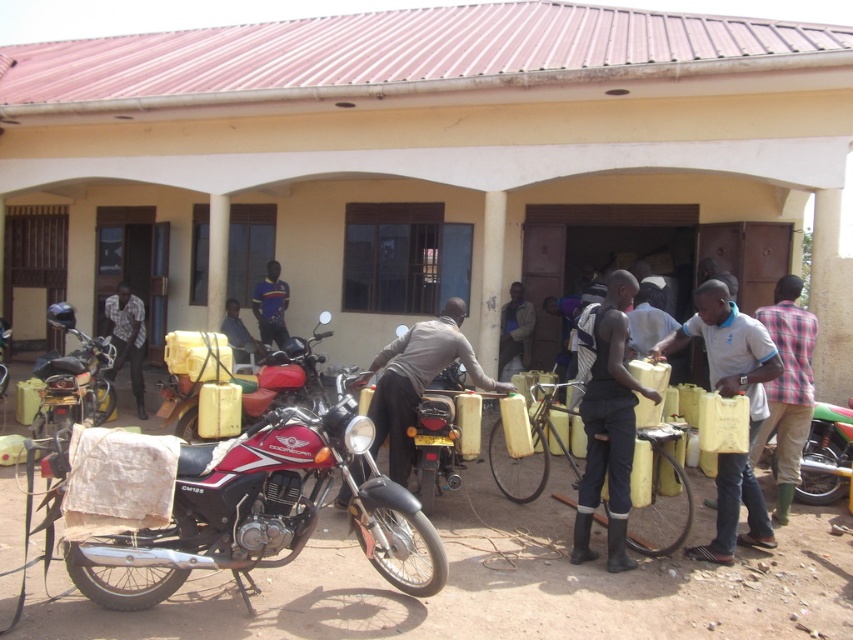
Does plaid shirt at center lie in front of light brown leather jacket at center?

That is True.

What do you see at coordinates (126, 339) in the screenshot?
I see `plaid shirt at center` at bounding box center [126, 339].

Who is more forward, (x=120, y=321) or (x=509, y=308)?

Point (x=120, y=321)

I want to click on plaid shirt at center, so (126, 339).

Is the position of plaid fabric shirt at center-right less distant than that of plaid shirt at center?

Yes, it is.

Who is positioned more to the left, plaid fabric shirt at center-right or plaid shirt at center?

From the viewer's perspective, plaid shirt at center appears more on the left side.

You are a GUI agent. You are given a task and a screenshot of the screen. Output one action in this format:
    pyautogui.click(x=<x>, y=<y>)
    Task: Click on the plaid fabric shirt at center-right
    
    Given the screenshot: What is the action you would take?
    pyautogui.click(x=787, y=388)

Is red glossy motorcycle at center closer to the viewer compared to light blue t-shirt at center?

That is True.

Does red glossy motorcycle at center have a greater height compared to light blue t-shirt at center?

In fact, red glossy motorcycle at center may be shorter than light blue t-shirt at center.

Who is more distant from viewer, (416, 531) or (762, 337)?

The point (762, 337) is behind.

Find the location of a particular element. This screenshot has height=640, width=853. red glossy motorcycle at center is located at coordinates (263, 509).